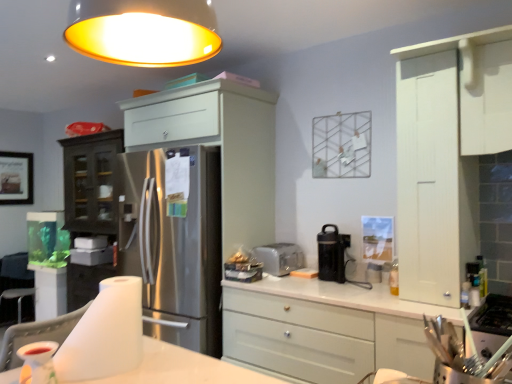
Question: Is wooden framed picture at left in front of or behind white glossy table at lower center in the image?

Choices:
 (A) behind
 (B) front

Answer: (A)

Question: From a real-world perspective, relative to white glossy table at lower center, is wooden framed picture at left vertically above or below?

Choices:
 (A) below
 (B) above

Answer: (B)

Question: Estimate the real-world distances between objects in this image. Which object is closer to the black plastic coffee machine at right?

Choices:
 (A) silver metallic toaster at center
 (B) white glossy table at lower center
 (C) satin white cabinet at center, placed as the 3th cabinetry when sorted from right to left
 (D) wooden framed picture at left
 (E) white matte cabinet at upper right, marked as the first cabinetry in a right-to-left arrangement

Answer: (A)

Question: Estimate the real-world distances between objects in this image. Which object is closer to the black plastic coffee machine at right?

Choices:
 (A) white matte cabinet at center, which is counted as the 2th cabinetry, starting from the right
 (B) translucent plastic cup at lower left
 (C) satin white cabinet at center, which ranks as the 1th cabinetry in left-to-right order
 (D) silver metallic toaster at center
 (E) white fabric chair at lower left

Answer: (D)